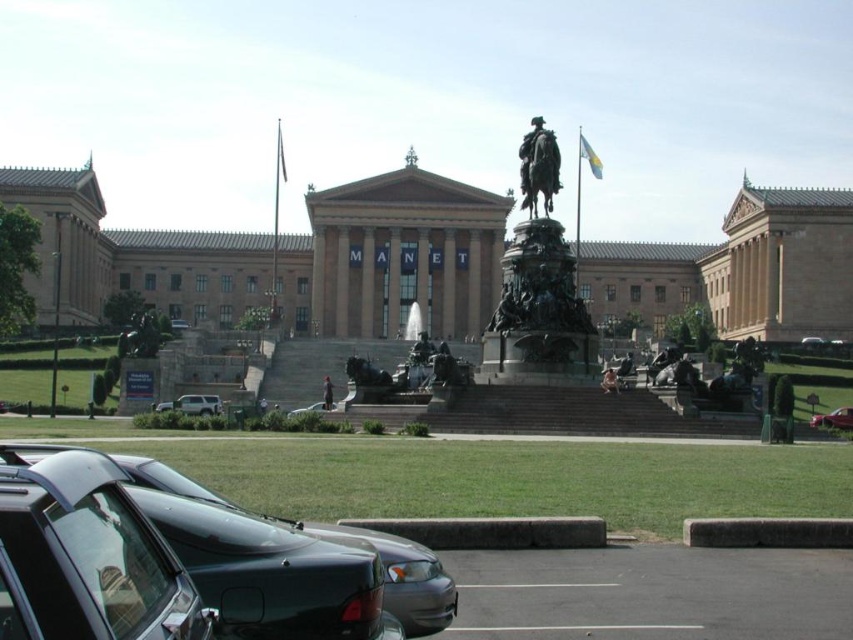
Which is behind, point (431, 596) or point (578, 144)?

The point (578, 144) is more distant.

Image resolution: width=853 pixels, height=640 pixels. Describe the element at coordinates (399, 576) in the screenshot. I see `shiny black sedan at lower left` at that location.

Locate an element on the screen. shiny black sedan at lower left is located at coordinates (399, 576).

Can you confirm if satin silver suv at lower left is shorter than white fabric flag at upper center?

Indeed, satin silver suv at lower left has a lesser height compared to white fabric flag at upper center.

You are a GUI agent. You are given a task and a screenshot of the screen. Output one action in this format:
    pyautogui.click(x=<x>, y=<y>)
    Task: Click on the satin silver suv at lower left
    The width and height of the screenshot is (853, 640).
    Given the screenshot: What is the action you would take?
    [x=192, y=404]

Locate an element on the screen. satin silver suv at lower left is located at coordinates (192, 404).

Consider the image. Is satin silver suv at lower left in front of metallic silver car at center?

Yes, it is in front of metallic silver car at center.

Is point (209, 412) positioned in front of point (175, 323)?

Yes, point (209, 412) is closer to viewer.

Is point (163, 404) more distant than point (181, 324)?

No, it is in front of (181, 324).

Image resolution: width=853 pixels, height=640 pixels. I want to click on satin silver suv at lower left, so click(x=192, y=404).